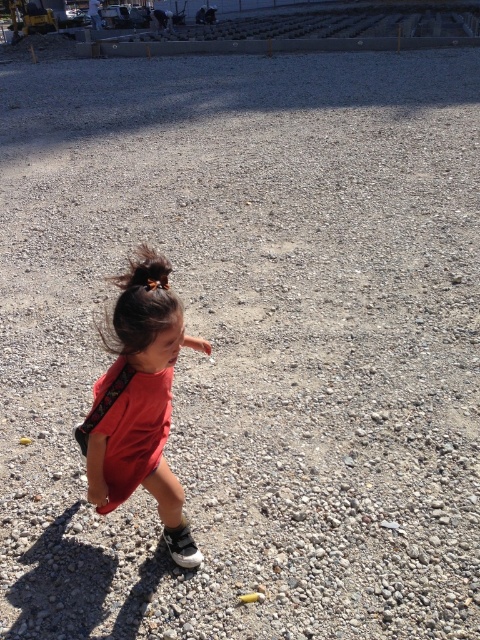
Question: Based on their relative distances, which object is nearer to the red cotton dress at center?

Choices:
 (A) matte red dress at center
 (B) brown shiny hair at upper left

Answer: (A)

Question: Which point appears farthest from the camera in this image?

Choices:
 (A) (141, 408)
 (B) (90, 477)
 (C) (117, 280)

Answer: (C)

Question: Among these points, which one is nearest to the camera?

Choices:
 (A) (160, 369)
 (B) (124, 438)

Answer: (A)

Question: Is matte red dress at center bigger than brown shiny hair at upper left?

Choices:
 (A) no
 (B) yes

Answer: (B)

Question: Does matte red dress at center come in front of brown shiny hair at upper left?

Choices:
 (A) no
 (B) yes

Answer: (B)

Question: Is the position of red cotton dress at center less distant than that of brown shiny hair at upper left?

Choices:
 (A) yes
 (B) no

Answer: (B)